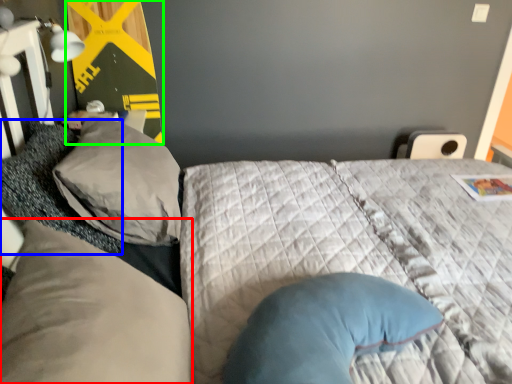
Question: Estimate the real-world distances between objects in this image. Which object is farther from pillow (highlighted by a red box), pillow (highlighted by a blue box) or bulletin board (highlighted by a green box)?

Choices:
 (A) pillow
 (B) bulletin board

Answer: (B)